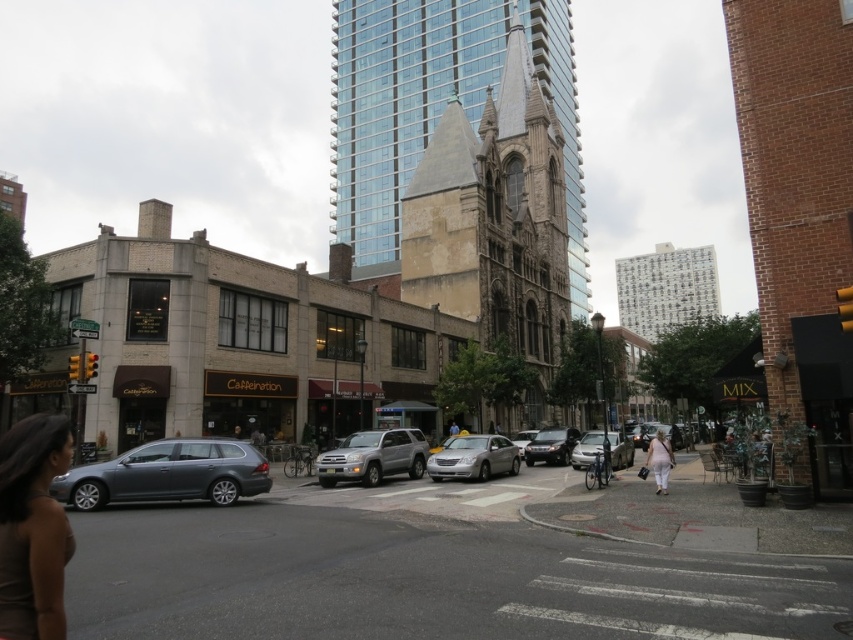
Question: Is metallic gray station wagon at lower left below satin silver car at center?

Choices:
 (A) no
 (B) yes

Answer: (A)

Question: Which object appears closest to the camera in this image?

Choices:
 (A) glassy steel tower at center
 (B) silver metallic sedan at center

Answer: (B)

Question: Which of these objects is positioned closest to the satin silver sedan at center?

Choices:
 (A) satin silver suv at center
 (B) brown matte shirt at lower left
 (C) shiny silver sedan at center
 (D) glassy steel tower at center

Answer: (A)

Question: Is metallic gray station wagon at lower left to the right of satin silver suv at center from the viewer's perspective?

Choices:
 (A) no
 (B) yes

Answer: (A)

Question: Considering the real-world distances, which object is closest to the white cotton dress at lower right?

Choices:
 (A) satin silver car at center
 (B) brown matte shirt at lower left

Answer: (A)

Question: Where is brown matte shirt at lower left located in relation to satin silver suv at center in the image?

Choices:
 (A) right
 (B) left

Answer: (B)